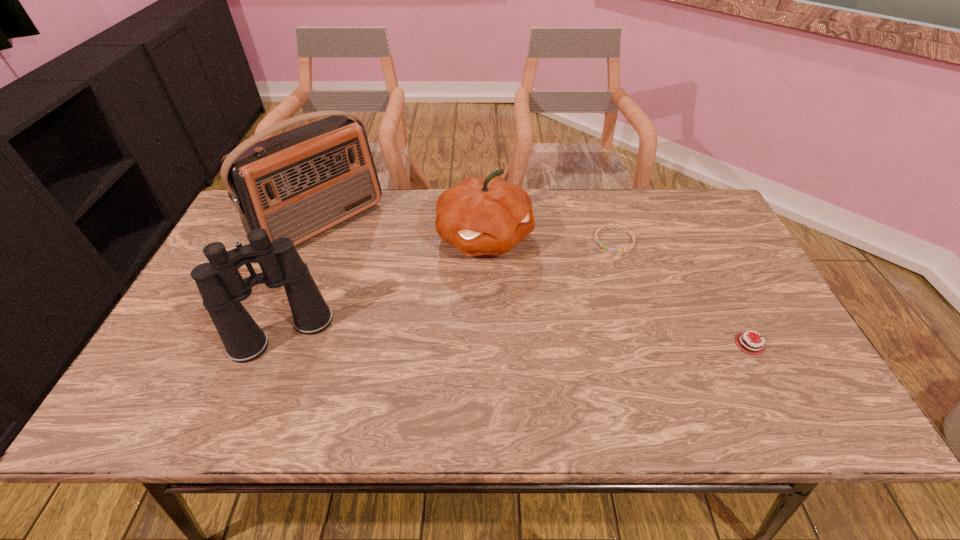
Locate an element on the screen. The width and height of the screenshot is (960, 540). bracelet that is at the far edge is located at coordinates (605, 247).

What are the coordinates of `radio receiver present at the far edge` in the screenshot? It's located at (299, 183).

At what (x,y) coordinates should I click in order to perform the action: click on binoculars located in the near edge section of the desktop. Please return your answer as a coordinate pair (x, y). Looking at the image, I should click on (222, 288).

You are a GUI agent. You are given a task and a screenshot of the screen. Output one action in this format:
    pyautogui.click(x=<x>, y=<y>)
    Task: Click on the chocolate cake that is at the near edge
    The image size is (960, 540).
    Given the screenshot: What is the action you would take?
    pyautogui.click(x=757, y=349)

At what (x,y) coordinates should I click in order to perform the action: click on binoculars at the left edge. Please return your answer as a coordinate pair (x, y). Looking at the image, I should click on (222, 288).

In order to click on radio receiver located in the left edge section of the desktop in this screenshot , I will do click(x=299, y=183).

Where is `object located in the right edge section of the desktop`? Image resolution: width=960 pixels, height=540 pixels. object located in the right edge section of the desktop is located at coordinates (757, 349).

Locate an element on the screen. This screenshot has height=540, width=960. object at the far left corner is located at coordinates (299, 183).

Where is `object at the near left corner`? This screenshot has height=540, width=960. object at the near left corner is located at coordinates (222, 288).

Image resolution: width=960 pixels, height=540 pixels. What are the coordinates of `object present at the near right corner` in the screenshot? It's located at (757, 349).